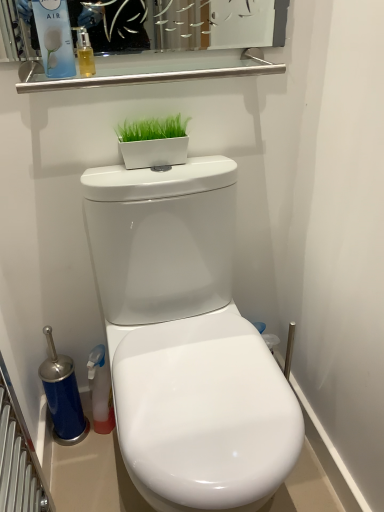
This screenshot has width=384, height=512. Find the location of `vacant space in front of white glossy flowerpot at upper center`. vacant space in front of white glossy flowerpot at upper center is located at coordinates (156, 176).